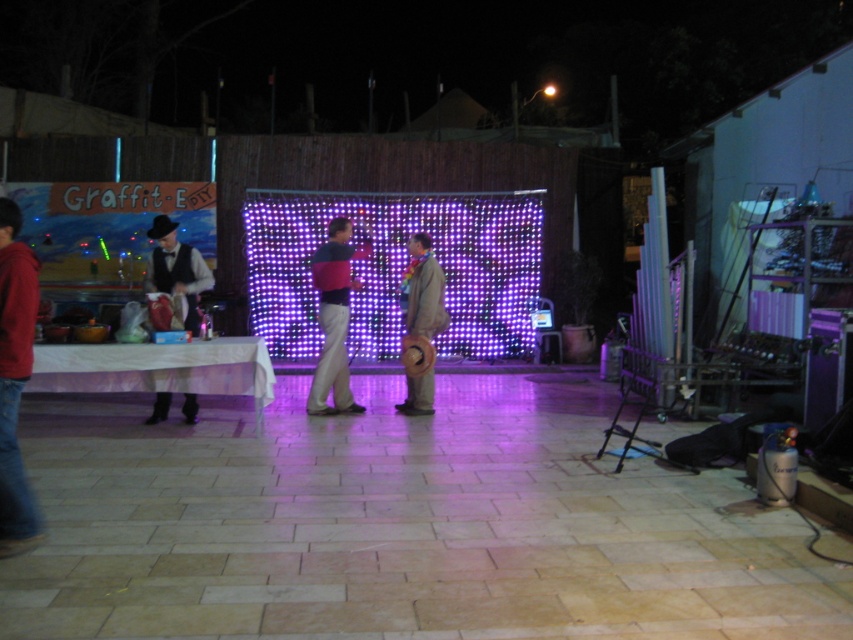
You are at a party and need to decide which item to take with you. The matte black vest at left and the brown suede hat at center are both on a table. If you can only carry one, which item should you choose if you prioritize carrying the larger item?

The matte black vest at left is larger in size than the brown suede hat at center, so you should choose the matte black vest at left.